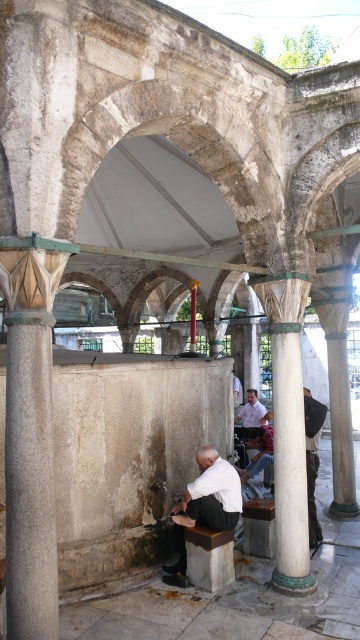
You are standing in the historical structure and want to touch both the white marble column at center and the white matte shirt at center. Which object should you reach for first to touch the closer one?

The white marble column at center is closer to the viewer than the white matte shirt at center, so you should reach for the white marble column at center first.